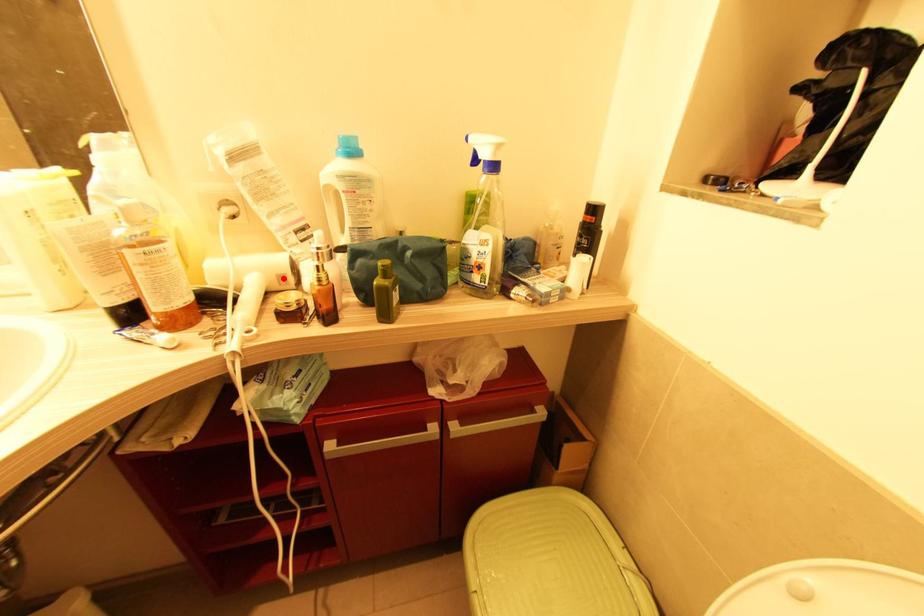
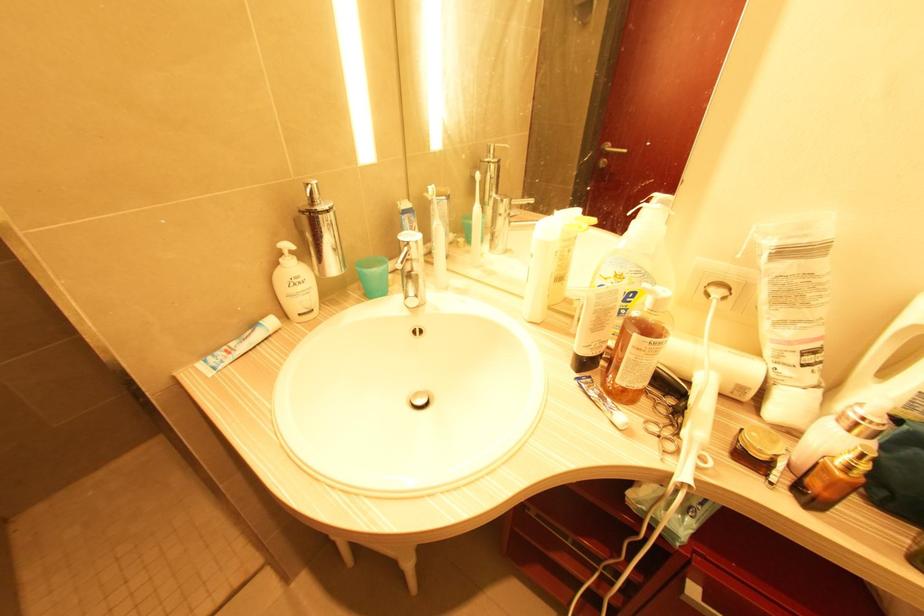
The point at the highlighted location is marked in the first image. Where is the corresponding point in the second image?

(743, 390)